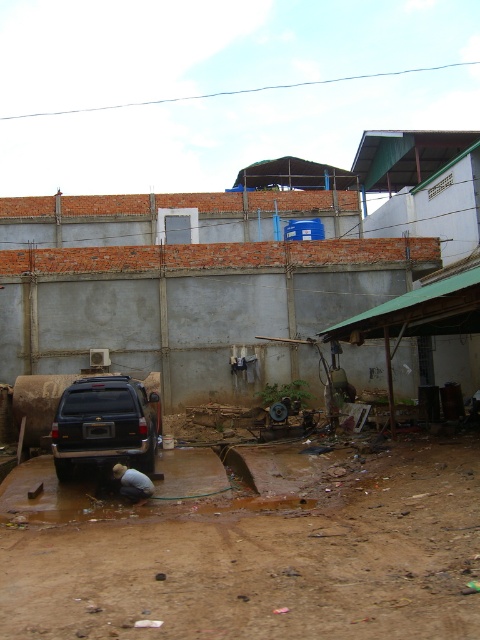
Question: Can you confirm if brown dirt track at lower center is positioned to the right of dark blue matte jeep at center?

Choices:
 (A) no
 (B) yes

Answer: (B)

Question: Which point is farther to the camera?

Choices:
 (A) dark blue matte jeep at center
 (B) brown dirt track at lower center

Answer: (A)

Question: Which object is farther from the camera taking this photo?

Choices:
 (A) brown dirt track at lower center
 (B) dark blue matte jeep at center

Answer: (B)

Question: In this image, where is brown dirt track at lower center located relative to dark blue matte jeep at center?

Choices:
 (A) left
 (B) right

Answer: (B)

Question: Does brown dirt track at lower center appear over dark blue matte jeep at center?

Choices:
 (A) no
 (B) yes

Answer: (A)